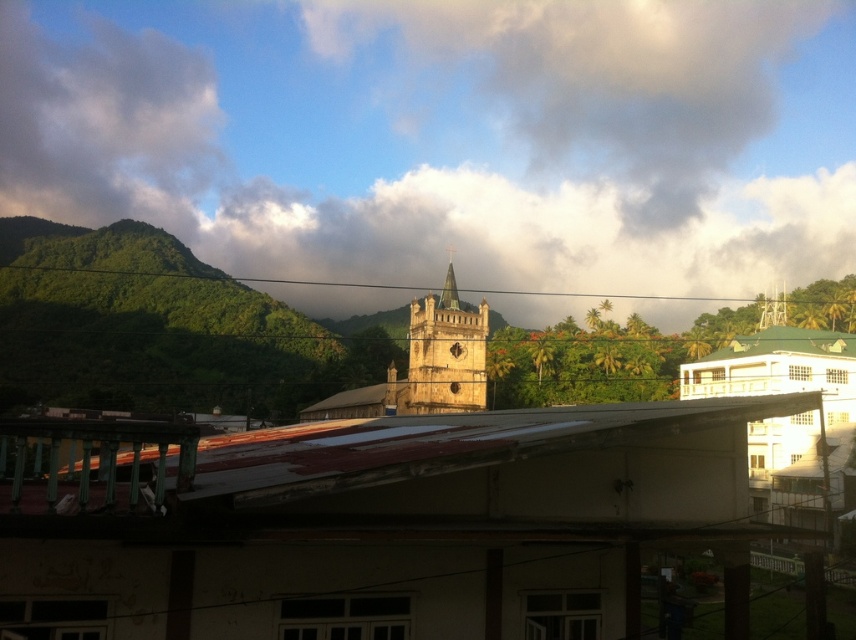
You are an architect analyzing the composition of the image. You notice the cloudy sky at upper center and the green copper spire at center. Which of these two elements has a greater horizontal span?

The cloudy sky at upper center has a greater horizontal span than the green copper spire at center, as its width surpasses that of the spire.

You are standing in front of the church steeple and want to take a photo that includes both the golden stone clock tower at center and the green copper spire at center. Which one should you focus on first to ensure both are in frame?

You should focus on the golden stone clock tower at center first since it is closer to the viewer than the green copper spire at center, ensuring both are within the frame by adjusting the camera angle accordingly.

You are standing in front of the church and notice the golden stone clock tower at center and the cloudy sky at upper center. Which object is closer to you?

The cloudy sky at upper center is closer to you because the golden stone clock tower at center is behind it.